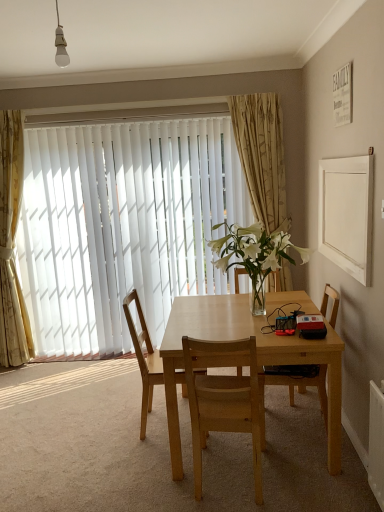
At what (x,y) coordinates should I click in order to perform the action: click on free space to the left of light brown wood chair at center, placed as the 2th chair when sorted from right to left. Please return your answer as a coordinate pair (x, y). Looking at the image, I should click on (151, 478).